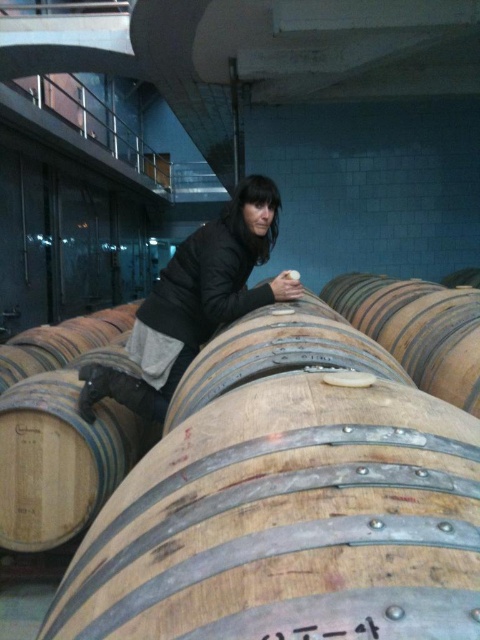
You are a tour guide leading a group through a winery. You want to point out the brown wooden barrel at center to your group. Considering the barrel is 20.33 inches away from you, can you safely approach closer to the barrel to get a better look without risking a collision?

The brown wooden barrel at center is 20.33 inches away from the viewer. Since this distance is within a safe proximity, you can approach closer to the barrel to get a better look without risking a collision.

You are a winery worker who needs to access the light brown wooden barrel at center. There is a dark gray jacket at center in your way. Which direction should you move to reach the barrel without disturbing the jacket?

Since the dark gray jacket at center is to the left of the light brown wooden barrel at center, you should move to the right to reach the barrel without disturbing the jacket.